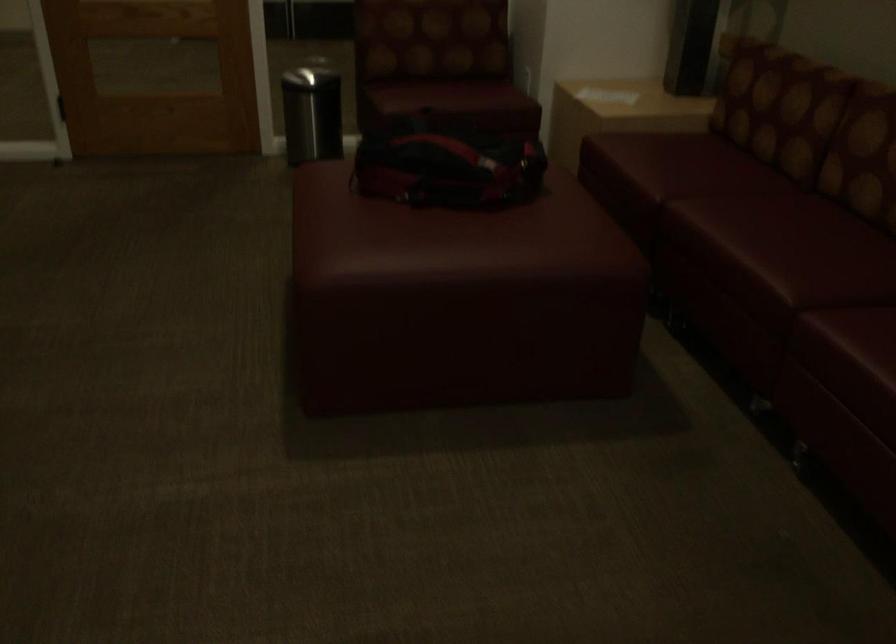
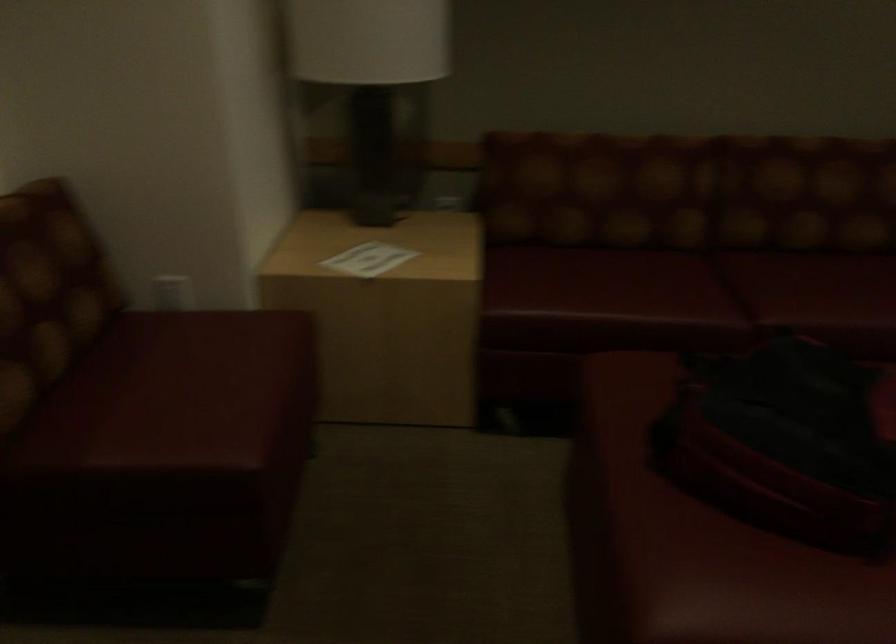
In the second image, find the point that corresponds to point (421, 82) in the first image.

(175, 393)